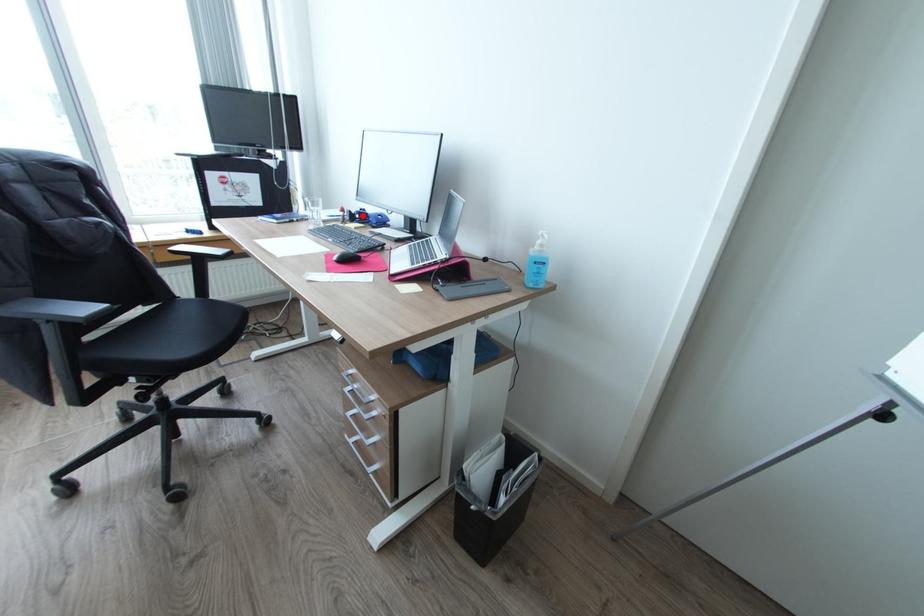
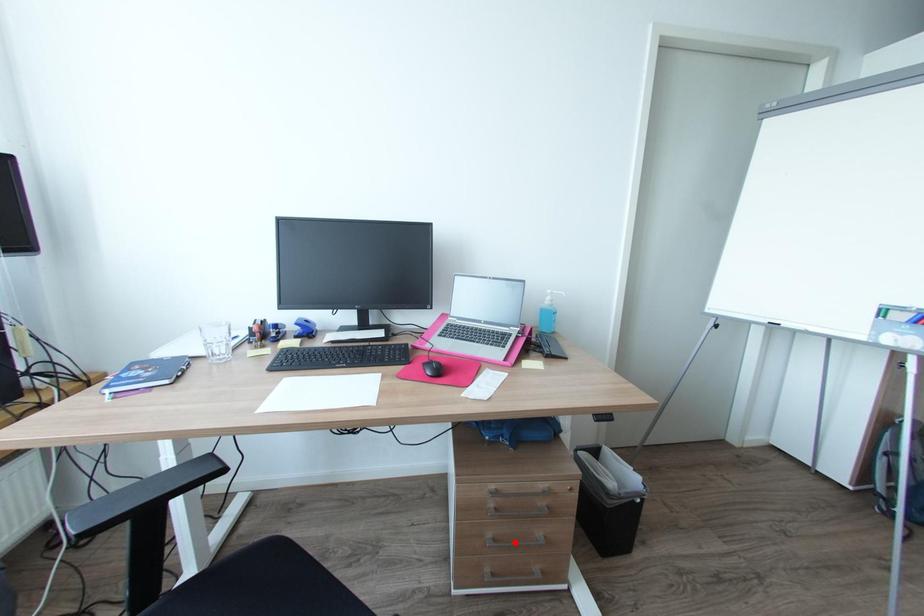
I am providing you with two images of the same scene from different viewpoints. A red point is marked on the first image and another point is marked on the second image. Are the points marked in image1 and image2 representing the same 3D position?

No